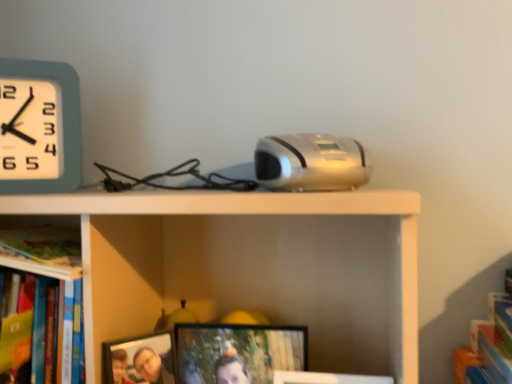
Find the location of a particular element. Image resolution: width=512 pixels, height=384 pixels. wooden photo frame at lower center, which appears as the 1th picture frame when viewed from the left is located at coordinates (139, 360).

Image resolution: width=512 pixels, height=384 pixels. What do you see at coordinates (139, 360) in the screenshot?
I see `wooden photo frame at lower center, which is the 2th picture frame in right-to-left order` at bounding box center [139, 360].

In order to click on teal plastic wall clock at upper left in this screenshot , I will do `click(41, 126)`.

Measure the distance between point (319, 153) and camera.

Answer: Point (319, 153) and camera are 23.46 inches apart from each other.

This screenshot has height=384, width=512. Describe the element at coordinates (310, 163) in the screenshot. I see `silver metallic projector at center` at that location.

Find the location of a particular element. The height and width of the screenshot is (384, 512). wooden photo frame at lower center, which appears as the 1th picture frame when viewed from the left is located at coordinates (139, 360).

Is matte black picture frame at center, the 2th picture frame viewed from the left, far from silver metallic projector at center?

No, matte black picture frame at center, the 2th picture frame viewed from the left, is not far from silver metallic projector at center.

Is matte black picture frame at center, which ranks as the first picture frame in right-to-left order, thinner than silver metallic projector at center?

Indeed, matte black picture frame at center, which ranks as the first picture frame in right-to-left order, has a lesser width compared to silver metallic projector at center.

Considering the positions of objects matte black picture frame at center, which ranks as the first picture frame in right-to-left order, and silver metallic projector at center in the image provided, who is in front, matte black picture frame at center, which ranks as the first picture frame in right-to-left order, or silver metallic projector at center?

silver metallic projector at center is closer to the camera.

Is wooden photo frame at lower center, which is the 2th picture frame in right-to-left order, facing away from matte black picture frame at center, the 2th picture frame viewed from the left?

That's not correct — wooden photo frame at lower center, which is the 2th picture frame in right-to-left order, is not looking away from matte black picture frame at center, the 2th picture frame viewed from the left.

Which object is closer to the camera, wooden photo frame at lower center, which is the 2th picture frame in right-to-left order, or matte black picture frame at center, the 2th picture frame viewed from the left?

Positioned in front is wooden photo frame at lower center, which is the 2th picture frame in right-to-left order.

Between wooden photo frame at lower center, which is the 2th picture frame in right-to-left order, and matte black picture frame at center, which ranks as the first picture frame in right-to-left order, which one appears on the right side from the viewer's perspective?

matte black picture frame at center, which ranks as the first picture frame in right-to-left order.

Would you consider matte black picture frame at center, which ranks as the first picture frame in right-to-left order, to be distant from wooden photo frame at lower center, which is the 2th picture frame in right-to-left order?

Actually, matte black picture frame at center, which ranks as the first picture frame in right-to-left order, and wooden photo frame at lower center, which is the 2th picture frame in right-to-left order, are a little close together.

Could you measure the distance between matte black picture frame at center, which ranks as the first picture frame in right-to-left order, and wooden photo frame at lower center, which is the 2th picture frame in right-to-left order?

Answer: 3.54 inches.

Considering the relative sizes of matte black picture frame at center, which ranks as the first picture frame in right-to-left order, and wooden photo frame at lower center, which appears as the 1th picture frame when viewed from the left, in the image provided, is matte black picture frame at center, which ranks as the first picture frame in right-to-left order, taller than wooden photo frame at lower center, which appears as the 1th picture frame when viewed from the left,?

Yes.

Visually, is matte black picture frame at center, the 2th picture frame viewed from the left, positioned to the left or to the right of wooden photo frame at lower center, which is the 2th picture frame in right-to-left order?

In the image, matte black picture frame at center, the 2th picture frame viewed from the left, appears on the right side of wooden photo frame at lower center, which is the 2th picture frame in right-to-left order.

In terms of size, does wooden photo frame at lower center, which appears as the 1th picture frame when viewed from the left, appear bigger or smaller than teal plastic wall clock at upper left?

Considering their sizes, wooden photo frame at lower center, which appears as the 1th picture frame when viewed from the left, takes up less space than teal plastic wall clock at upper left.

Can you confirm if wooden photo frame at lower center, which is the 2th picture frame in right-to-left order, is taller than teal plastic wall clock at upper left?

No, wooden photo frame at lower center, which is the 2th picture frame in right-to-left order, is not taller than teal plastic wall clock at upper left.

Can you confirm if wooden photo frame at lower center, which appears as the 1th picture frame when viewed from the left, is wider than teal plastic wall clock at upper left?

Correct, the width of wooden photo frame at lower center, which appears as the 1th picture frame when viewed from the left, exceeds that of teal plastic wall clock at upper left.

Which is correct: silver metallic projector at center is inside teal plastic wall clock at upper left, or outside of it?

silver metallic projector at center cannot be found inside teal plastic wall clock at upper left.

Is silver metallic projector at center to the right of teal plastic wall clock at upper left from the viewer's perspective?

Yes.

Are silver metallic projector at center and teal plastic wall clock at upper left beside each other?

silver metallic projector at center and teal plastic wall clock at upper left are not in contact.

From a real-world perspective, is silver metallic projector at center above or below teal plastic wall clock at upper left?

In terms of real-world spatial position, silver metallic projector at center is below teal plastic wall clock at upper left.

Considering the sizes of objects silver metallic projector at center and matte black picture frame at center, the 2th picture frame viewed from the left, in the image provided, who is bigger, silver metallic projector at center or matte black picture frame at center, the 2th picture frame viewed from the left,?

silver metallic projector at center.

Which is correct: silver metallic projector at center is inside matte black picture frame at center, the 2th picture frame viewed from the left, or outside of it?

silver metallic projector at center exists outside the volume of matte black picture frame at center, the 2th picture frame viewed from the left.

Could you measure the distance between silver metallic projector at center and matte black picture frame at center, which ranks as the first picture frame in right-to-left order?

They are 10.92 inches apart.

Looking at the image, does matte black picture frame at center, which ranks as the first picture frame in right-to-left order, seem bigger or smaller compared to teal plastic wall clock at upper left?

matte black picture frame at center, which ranks as the first picture frame in right-to-left order, is bigger than teal plastic wall clock at upper left.

Where is `wall clock behind the matte black picture frame at center, the 2th picture frame viewed from the left`? This screenshot has width=512, height=384. wall clock behind the matte black picture frame at center, the 2th picture frame viewed from the left is located at coordinates (41, 126).

Is matte black picture frame at center, the 2th picture frame viewed from the left, to the right of teal plastic wall clock at upper left from the viewer's perspective?

Indeed, matte black picture frame at center, the 2th picture frame viewed from the left, is positioned on the right side of teal plastic wall clock at upper left.

What's the angular difference between matte black picture frame at center, which ranks as the first picture frame in right-to-left order, and teal plastic wall clock at upper left's facing directions?

The angle between the facing direction of matte black picture frame at center, which ranks as the first picture frame in right-to-left order, and the facing direction of teal plastic wall clock at upper left is 27 degrees.

What are the coordinates of `the 2nd picture frame behind the silver metallic projector at center, counting from the anchor's position` in the screenshot? It's located at (238, 352).

This screenshot has height=384, width=512. What are the coordinates of `picture frame on the right of wooden photo frame at lower center, which is the 2th picture frame in right-to-left order` in the screenshot? It's located at (238, 352).

Looking at the image, which one is located closer to matte black picture frame at center, the 2th picture frame viewed from the left, silver metallic projector at center or wooden photo frame at lower center, which is the 2th picture frame in right-to-left order?

Among the two, wooden photo frame at lower center, which is the 2th picture frame in right-to-left order, is located nearer to matte black picture frame at center, the 2th picture frame viewed from the left.

Considering their positions, is silver metallic projector at center positioned further to matte black picture frame at center, which ranks as the first picture frame in right-to-left order, than teal plastic wall clock at upper left?

teal plastic wall clock at upper left is positioned further to the anchor matte black picture frame at center, which ranks as the first picture frame in right-to-left order.

When comparing their distances from wooden photo frame at lower center, which appears as the 1th picture frame when viewed from the left, does silver metallic projector at center or teal plastic wall clock at upper left seem closer?

silver metallic projector at center is closer to wooden photo frame at lower center, which appears as the 1th picture frame when viewed from the left.

Considering their positions, is teal plastic wall clock at upper left positioned closer to silver metallic projector at center than matte black picture frame at center, the 2th picture frame viewed from the left?

matte black picture frame at center, the 2th picture frame viewed from the left.

Based on their spatial positions, is teal plastic wall clock at upper left or wooden photo frame at lower center, which appears as the 1th picture frame when viewed from the left, closer to matte black picture frame at center, which ranks as the first picture frame in right-to-left order?

wooden photo frame at lower center, which appears as the 1th picture frame when viewed from the left.

Considering their positions, is wooden photo frame at lower center, which appears as the 1th picture frame when viewed from the left, positioned closer to silver metallic projector at center than teal plastic wall clock at upper left?

wooden photo frame at lower center, which appears as the 1th picture frame when viewed from the left, lies closer to silver metallic projector at center than the other object.

From the image, which object appears to be nearer to teal plastic wall clock at upper left, wooden photo frame at lower center, which is the 2th picture frame in right-to-left order, or silver metallic projector at center?

wooden photo frame at lower center, which is the 2th picture frame in right-to-left order.

When comparing their distances from wooden photo frame at lower center, which appears as the 1th picture frame when viewed from the left, does teal plastic wall clock at upper left or matte black picture frame at center, which ranks as the first picture frame in right-to-left order, seem closer?

matte black picture frame at center, which ranks as the first picture frame in right-to-left order, is positioned closer to the anchor wooden photo frame at lower center, which appears as the 1th picture frame when viewed from the left.

Locate an element on the screen. picture frame between teal plastic wall clock at upper left and wooden photo frame at lower center, which appears as the 1th picture frame when viewed from the left, in the up-down direction is located at coordinates (238, 352).

The image size is (512, 384). What are the coordinates of `picture frame that lies between silver metallic projector at center and wooden photo frame at lower center, which is the 2th picture frame in right-to-left order, from top to bottom` in the screenshot? It's located at (238, 352).